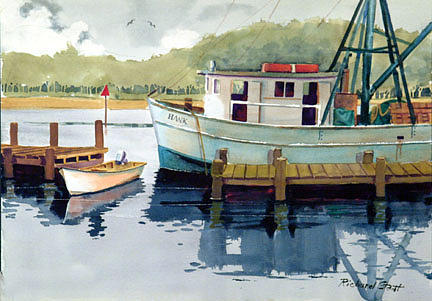
This screenshot has height=301, width=432. What are the coordinates of `painting` in the screenshot? It's located at (182, 144).